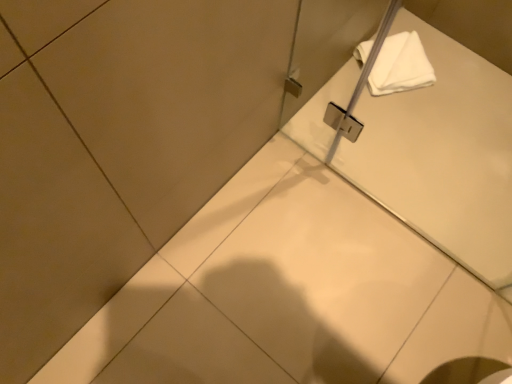
Locate an element on the screen. The image size is (512, 384). white soft towel at upper right is located at coordinates (400, 66).

What do you see at coordinates (400, 66) in the screenshot? I see `white soft towel at upper right` at bounding box center [400, 66].

Measure the distance between point (410, 78) and camera.

5.40 feet.

Locate an element on the screen. white soft towel at upper right is located at coordinates (400, 66).